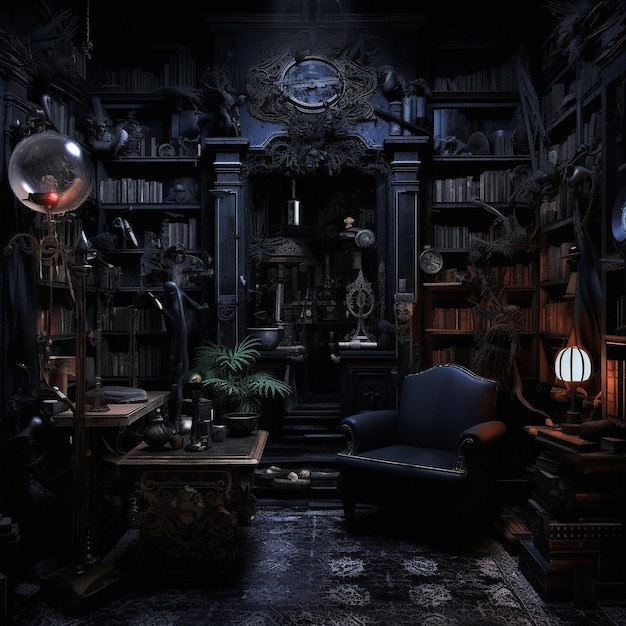
In order to click on chair arm in this screenshot , I will do `click(485, 438)`, `click(367, 426)`.